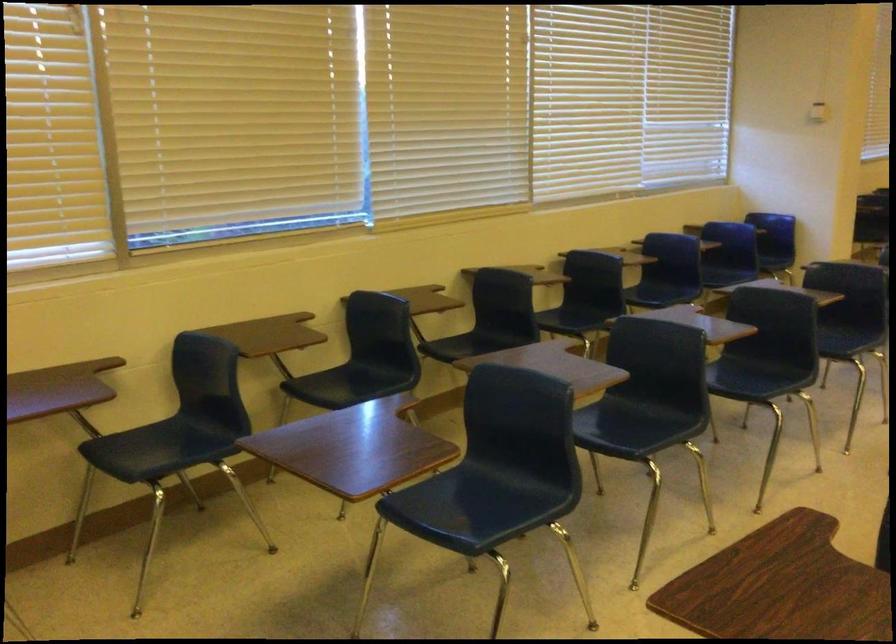
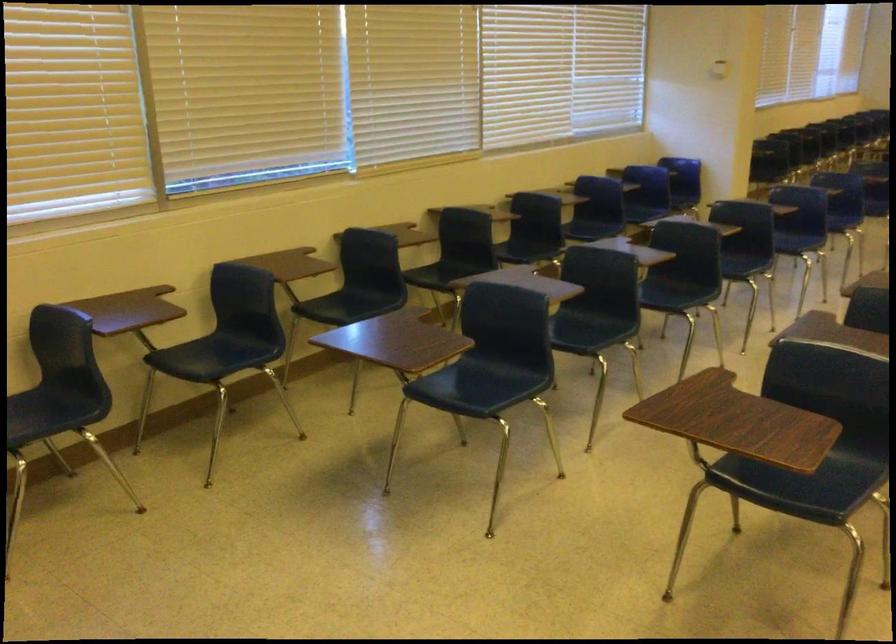
Locate, in the second image, the point that corresponds to (x=462, y=506) in the first image.

(467, 386)